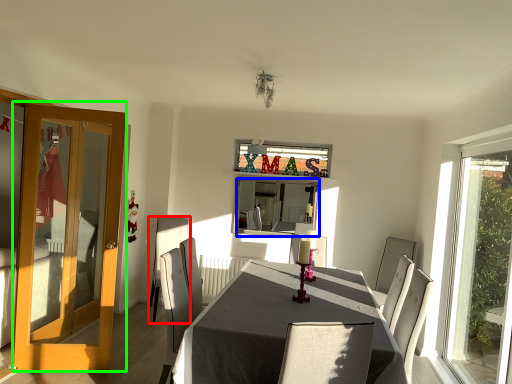
Question: Based on their relative distances, which object is farther from chair (highlighted by a red box)? Choose from mirror (highlighted by a blue box) and door (highlighted by a green box).

Choices:
 (A) mirror
 (B) door

Answer: (B)